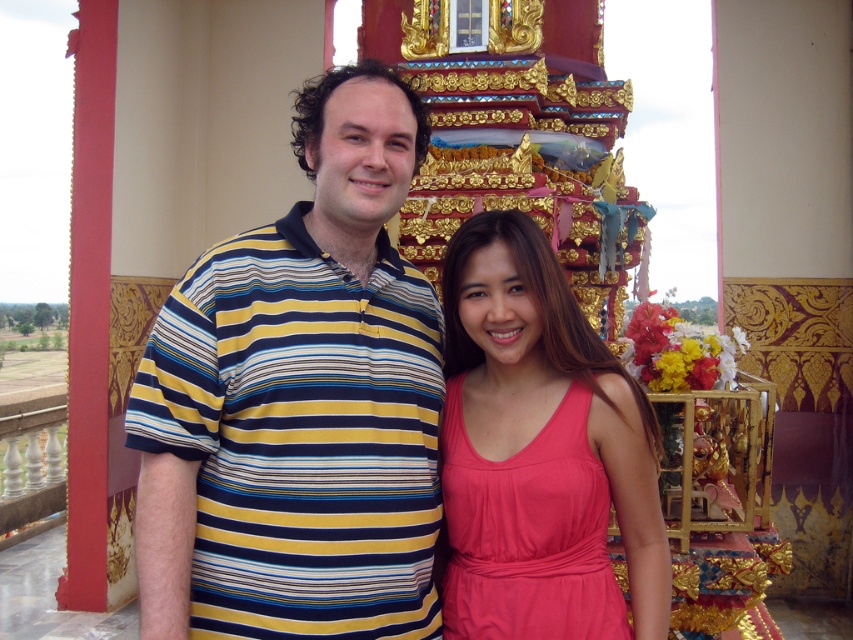
Question: Which point is closer to the camera?

Choices:
 (A) (519, 582)
 (B) (350, 163)

Answer: (A)

Question: Which of the following is the farthest from the observer?

Choices:
 (A) pink satin dress at center
 (B) striped cotton shirt at center

Answer: (A)

Question: Can you confirm if striped cotton shirt at center is wider than pink satin dress at center?

Choices:
 (A) yes
 (B) no

Answer: (A)

Question: Which point is closer to the camera?

Choices:
 (A) striped cotton shirt at center
 (B) pink satin dress at center

Answer: (A)

Question: Can you confirm if striped cotton shirt at center is wider than pink satin dress at center?

Choices:
 (A) no
 (B) yes

Answer: (B)

Question: Is striped cotton shirt at center above pink satin dress at center?

Choices:
 (A) no
 (B) yes

Answer: (B)